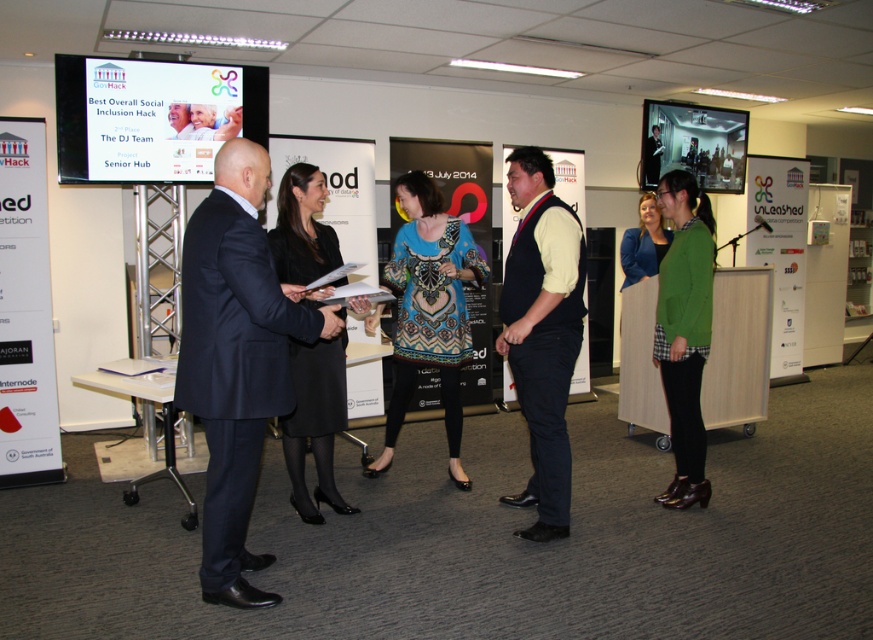
Is the position of dark blue suit at center less distant than that of matte black suit at center?

Yes, it is.

Between dark blue suit at center and matte black suit at center, which one is positioned lower?

dark blue suit at center

Which is behind, point (218, 445) or point (177, 112)?

Point (177, 112)

The width and height of the screenshot is (873, 640). Find the location of `dark blue suit at center`. dark blue suit at center is located at coordinates (236, 358).

Find the location of `white paper at left`. white paper at left is located at coordinates (25, 312).

Which is more to the left, white paper at left or black suit at center?

white paper at left is more to the left.

Does point (45, 253) lie behind point (645, 138)?

No, (45, 253) is in front of (645, 138).

At what (x,y) coordinates should I click in order to perform the action: click on white paper at left. Please return your answer as a coordinate pair (x, y). Looking at the image, I should click on (25, 312).

Is white paper at left further to camera compared to patterned fabric dress at center?

Yes, it is.

Between white paper at left and patterned fabric dress at center, which one is positioned lower?

patterned fabric dress at center is lower down.

Does point (9, 467) lie behind point (452, 339)?

That is True.

Identify the location of white paper at left. The image size is (873, 640). (25, 312).